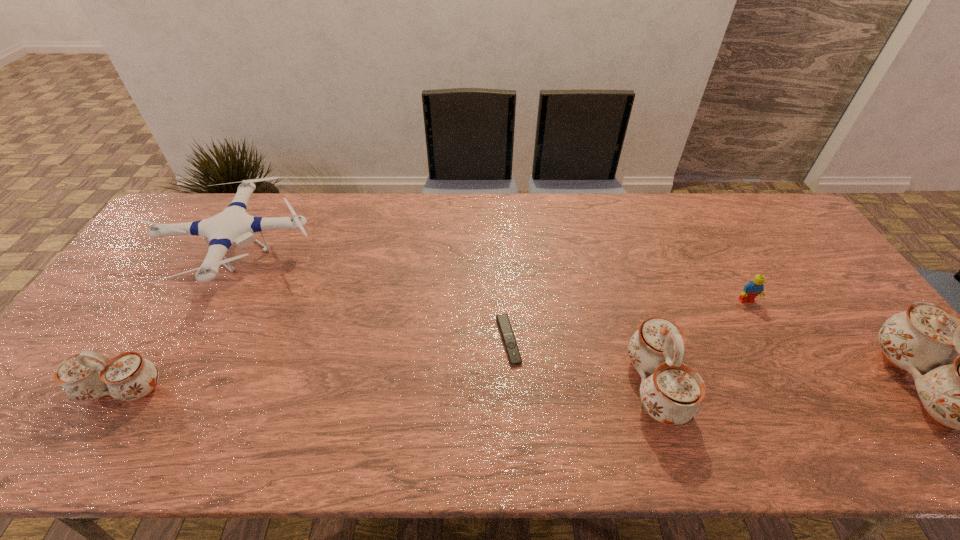
The image size is (960, 540). I want to click on empty location between the leftmost chinaware and the third object from right to left, so click(x=390, y=388).

Find the location of a particular element. This screenshot has width=960, height=540. vacant space that's between the second chinaware from right to left and the remote control is located at coordinates (582, 363).

Select which object appears as the fifth closest to the leftmost chinaware. Please provide its 2D coordinates. Your answer should be formatted as a tuple, i.e. [(x, y)], where the tuple contains the x and y coordinates of a point satisfying the conditions above.

[(958, 392)]

Identify which object is located as the nearest to the second chinaware from right to left. Please provide its 2D coordinates. Your answer should be formatted as a tuple, i.e. [(x, y)], where the tuple contains the x and y coordinates of a point satisfying the conditions above.

[(512, 350)]

Locate an element on the screen. Image resolution: width=960 pixels, height=540 pixels. chinaware that stands as the second closest to the second tallest chinaware is located at coordinates point(88,375).

Identify the location of chinaware identified as the third closest to the drone. This screenshot has width=960, height=540. (958, 392).

I want to click on free space in the image that satisfies the following two spatial constraints: 1. on the face of the Lego; 2. by the handle of the third object from right to left, so click(x=794, y=387).